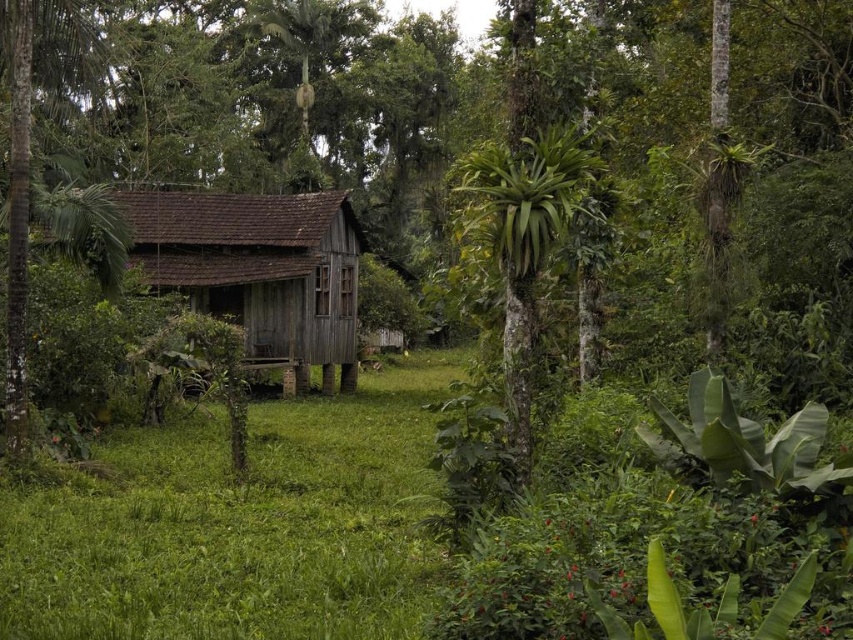
Looking at this image, you are standing on the green grass at center and want to enter the weathered wood hut at center. Which direction should you move to reach the entrance?

Since the green grass at center is below the weathered wood hut at center, you should move upward to reach the entrance.

You are standing at the entrance of the rustic wooden hut and want to place a small potted plant exactly at the center of the green grass at center. According to the image, what are the coordinates where you should place the potted plant?

Result: The coordinates for the green grass at center are at point (239,525), so you should place the potted plant at those coordinates.